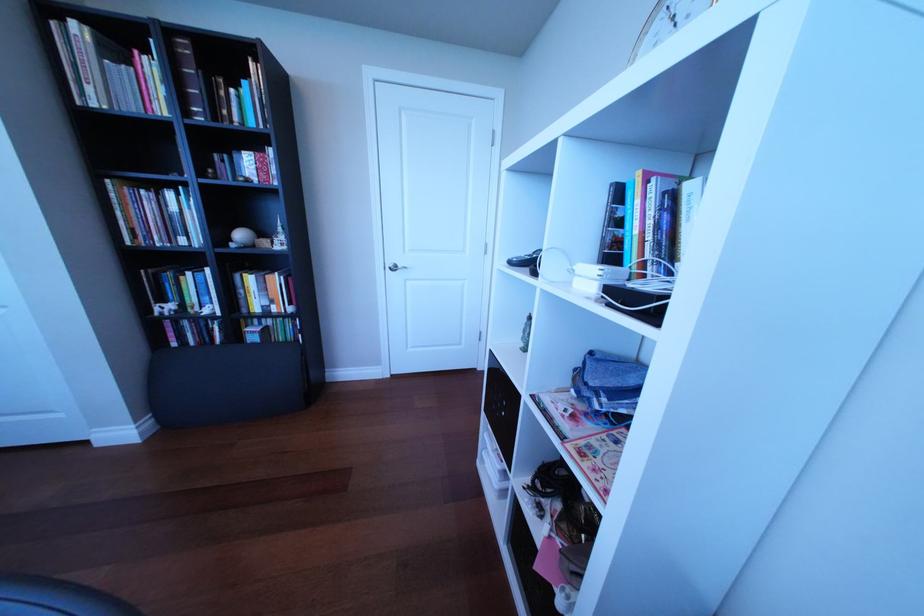
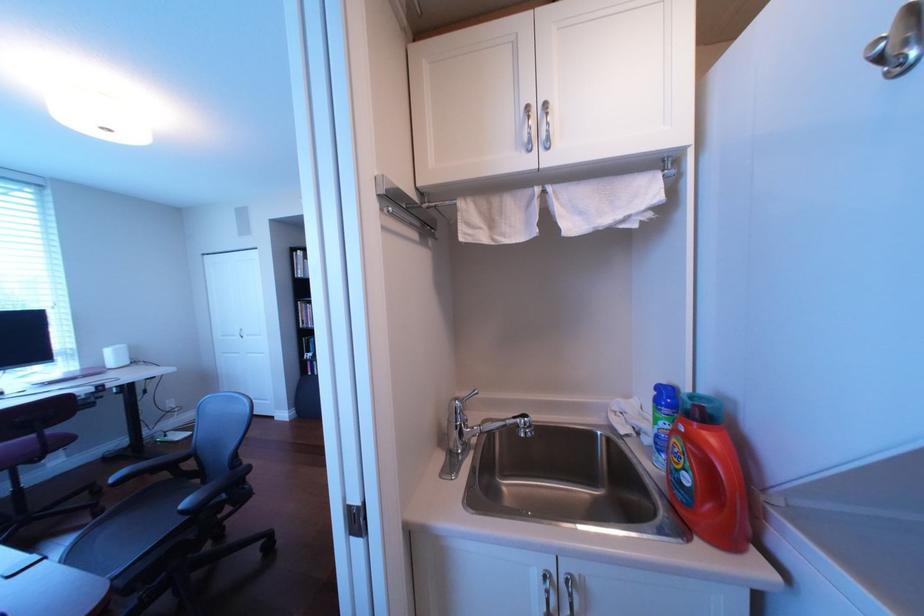
In a continuous first-person perspective shot, in which direction is the camera moving?

The cameraman moved toward right, backward.